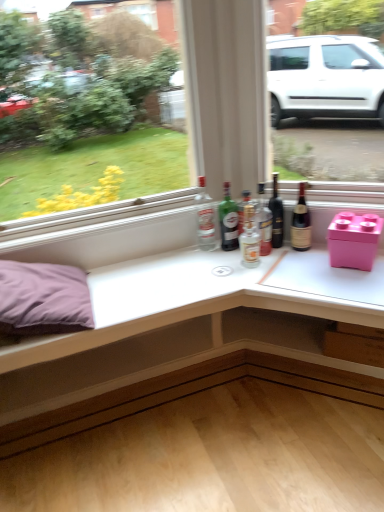
This screenshot has height=512, width=384. Identify the location of free space to the left of green glass bottle at center, which ranks as the 4th bottle in right-to-left order. (192, 256).